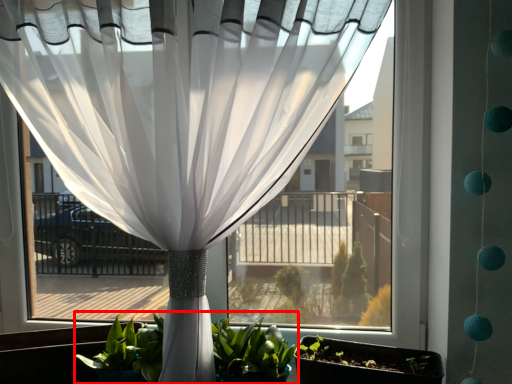
Question: Where is houseplant (annotated by the red box) located in relation to flowerpot in the image?

Choices:
 (A) right
 (B) left

Answer: (B)